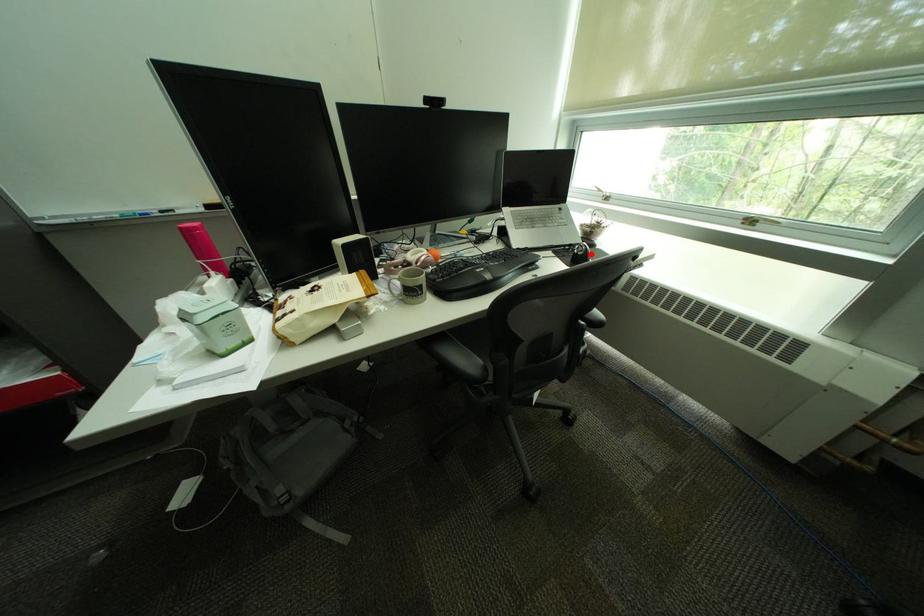
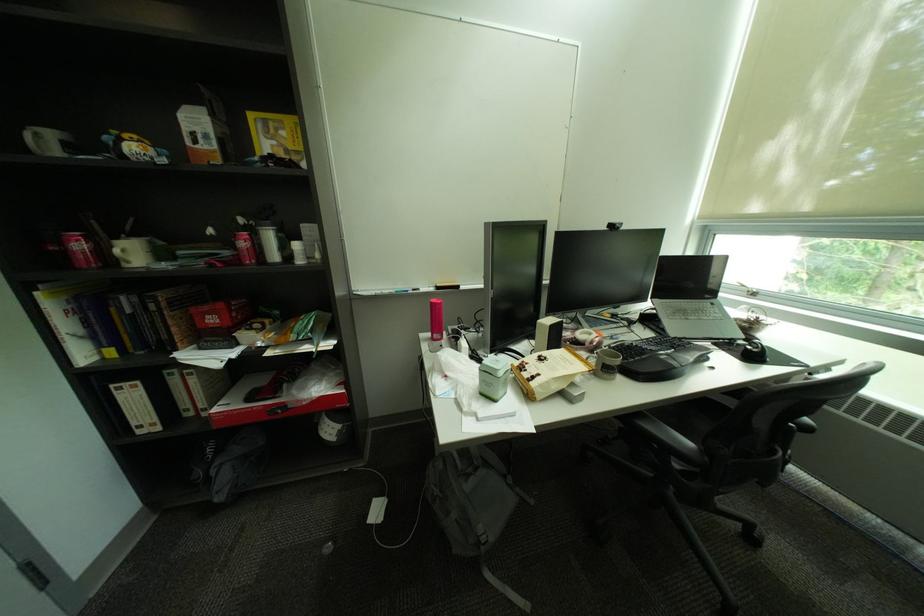
Question: I am providing you with two images of the same scene from different viewpoints. In image1, a red point is highlighted. Considering the same 3D point in image2, which of the following is correct?

Choices:
 (A) It is closer
 (B) It is farther

Answer: (A)